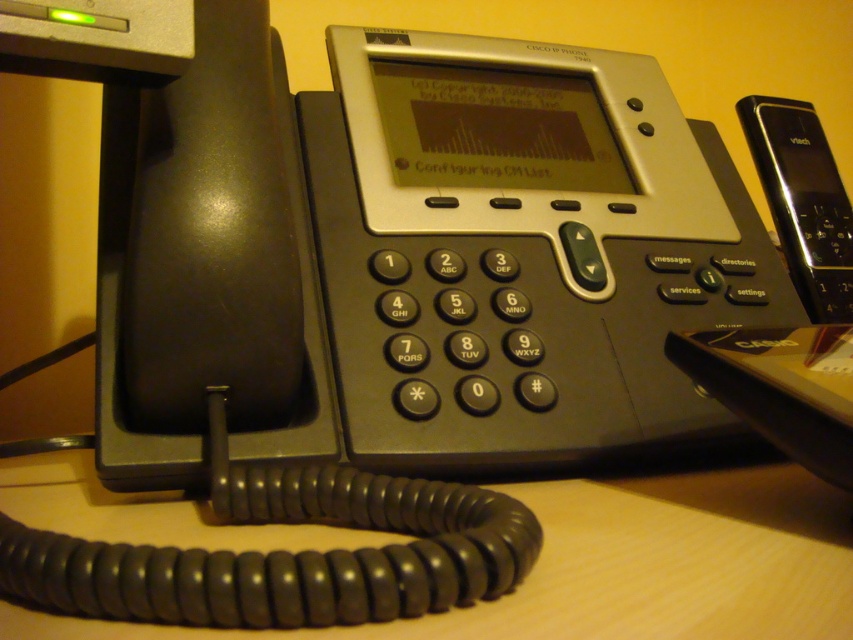
Can you confirm if wooden table at center is positioned to the right of black plastic phone at right?

No, wooden table at center is not to the right of black plastic phone at right.

Is wooden table at center wider than black plastic phone at right?

Yes, wooden table at center is wider than black plastic phone at right.

Which is in front, point (735, 541) or point (811, 220)?

Point (735, 541) is in front.

This screenshot has width=853, height=640. I want to click on wooden table at center, so click(630, 566).